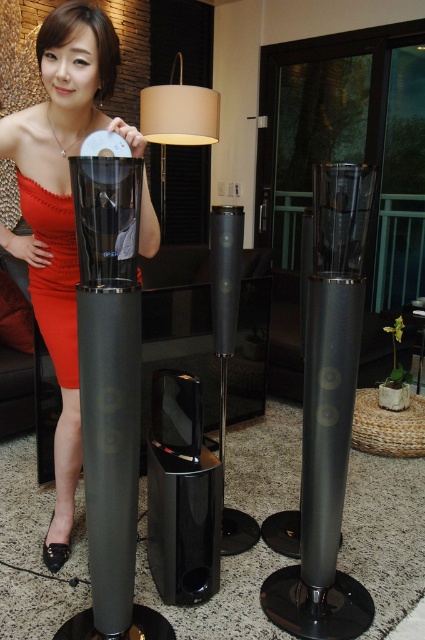
Does matte beige lampshade at center have a lesser height compared to matte red dress at left?

Incorrect, matte beige lampshade at center's height does not fall short of matte red dress at left's.

Which is more to the left, matte beige lampshade at center or matte red dress at left?

matte red dress at left

Image resolution: width=425 pixels, height=640 pixels. I want to click on matte beige lampshade at center, so click(181, 148).

The image size is (425, 640). Find the location of `matte beige lampshade at center`. matte beige lampshade at center is located at coordinates (181, 148).

Is point (73, 131) in front of point (141, 131)?

Yes, point (73, 131) is in front of point (141, 131).

Is the position of matte black dress at center less distant than that of beige fabric lampshade at upper center?

Yes.

Which is behind, point (34, 282) or point (155, 88)?

The point (155, 88) is behind.

This screenshot has width=425, height=640. What are the coordinates of `matte black dress at center` in the screenshot? It's located at (61, 212).

Does glossy black speaker at center have a greater width compared to matte beige lampshade at center?

In fact, glossy black speaker at center might be narrower than matte beige lampshade at center.

Does glossy black speaker at center have a greater height compared to matte beige lampshade at center?

Yes, glossy black speaker at center is taller than matte beige lampshade at center.

Does point (345, 272) come in front of point (163, 241)?

That is True.

This screenshot has height=640, width=425. I want to click on glossy black speaker at center, so click(x=328, y=413).